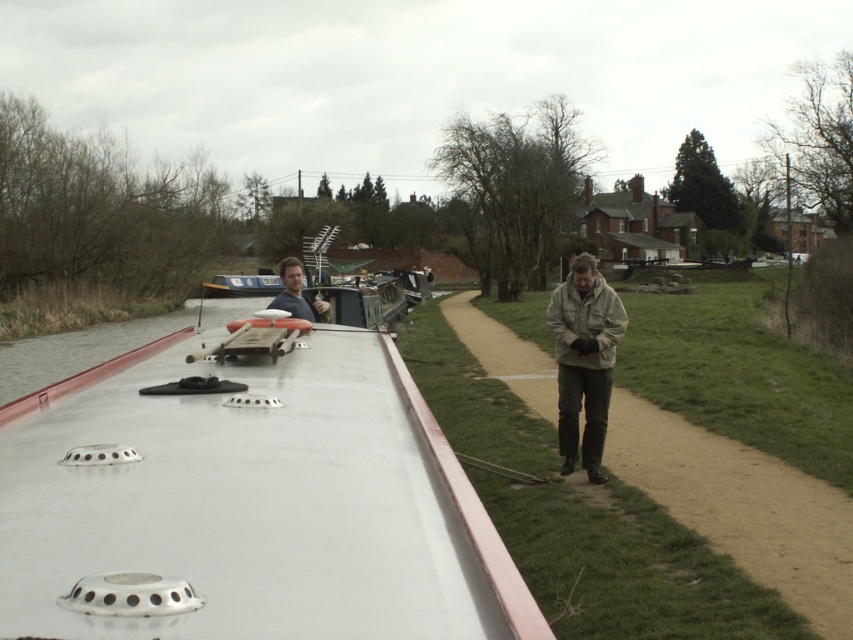
Who is lower down, matte gray shirt at center or blue glossy boat at center?

matte gray shirt at center

Does point (316, 310) come in front of point (212, 285)?

That is True.

What do you see at coordinates (297, 292) in the screenshot? I see `matte gray shirt at center` at bounding box center [297, 292].

This screenshot has width=853, height=640. In order to click on matte gray shirt at center in this screenshot , I will do `click(297, 292)`.

Can you confirm if white glossy boat at left is positioned to the left of blue glossy boat at center?

Incorrect, white glossy boat at left is not on the left side of blue glossy boat at center.

Who is shorter, white glossy boat at left or blue glossy boat at center?

With less height is white glossy boat at left.

Is point (178, 445) positioned before point (238, 285)?

Yes, it is.

Identify the location of white glossy boat at left. [x=258, y=504].

Can you confirm if tan fabric jacket at right is wider than blue glossy boat at center?

No, tan fabric jacket at right is not wider than blue glossy boat at center.

Who is more distant from viewer, (653, 436) or (257, 285)?

The point (257, 285) is more distant.

In order to click on tan fabric jacket at right in this screenshot , I will do `click(741, 506)`.